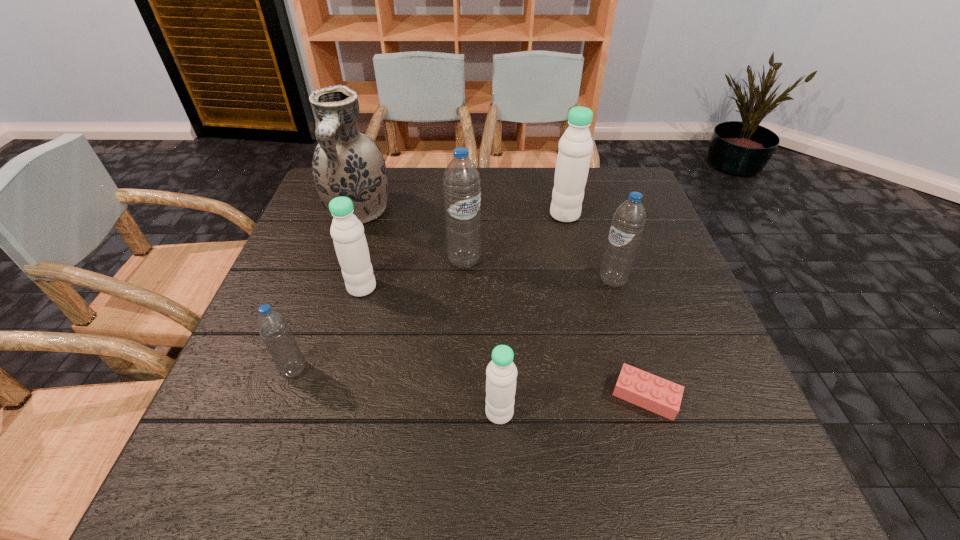
At what (x,y) coordinates should I click in order to perform the action: click on free space between the rightmost water bottle and the leftmost water bottle. Please return your answer as a coordinate pair (x, y). Image resolution: width=960 pixels, height=540 pixels. Looking at the image, I should click on (453, 325).

You are a GUI agent. You are given a task and a screenshot of the screen. Output one action in this format:
    pyautogui.click(x=<x>, y=<y>)
    Task: Click on the vacant area that lies between the smallest blue water bottle and the fifth water bottle from right to left
    This screenshot has width=960, height=540.
    Given the screenshot: What is the action you would take?
    pyautogui.click(x=328, y=329)

This screenshot has height=540, width=960. In order to click on free space that is in between the second nearest water bottle and the smallest white water bottle in this screenshot , I will do `click(396, 391)`.

You are a GUI agent. You are given a task and a screenshot of the screen. Output one action in this format:
    pyautogui.click(x=<x>, y=<y>)
    Task: Click on the free space that is in between the fifth water bottle from right to left and the nearest water bottle
    
    Given the screenshot: What is the action you would take?
    pyautogui.click(x=431, y=350)

You are a GUI agent. You are given a task and a screenshot of the screen. Output one action in this format:
    pyautogui.click(x=<x>, y=<y>)
    Task: Click on the object that can be found as the sixth closest to the Lego
    
    Given the screenshot: What is the action you would take?
    pyautogui.click(x=272, y=325)

The width and height of the screenshot is (960, 540). What are the coordinates of `object that is the seventh closest to the fifth farthest water bottle` in the screenshot? It's located at (575, 146).

This screenshot has width=960, height=540. What are the coordinates of `the fourth closest water bottle to the vase` in the screenshot? It's located at (575, 146).

Locate which water bottle ranks fourth in proximity to the leftmost white water bottle. Please provide its 2D coordinates. Your answer should be formatted as a tuple, i.e. [(x, y)], where the tuple contains the x and y coordinates of a point satisfying the conditions above.

[(575, 146)]

Where is `the third closest white water bottle to the third water bottle from left to right`? The image size is (960, 540). the third closest white water bottle to the third water bottle from left to right is located at coordinates (501, 372).

In order to click on the second closest white water bottle relative to the vase in this screenshot , I will do `click(575, 146)`.